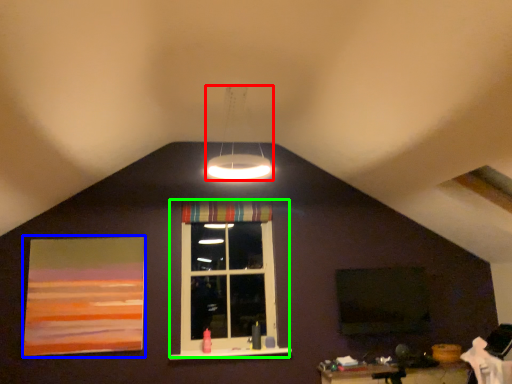
Question: Estimate the real-world distances between objects in this image. Which object is closer to lamp (highlighted by a red box), picture frame (highlighted by a blue box) or window (highlighted by a green box)?

Choices:
 (A) picture frame
 (B) window

Answer: (B)